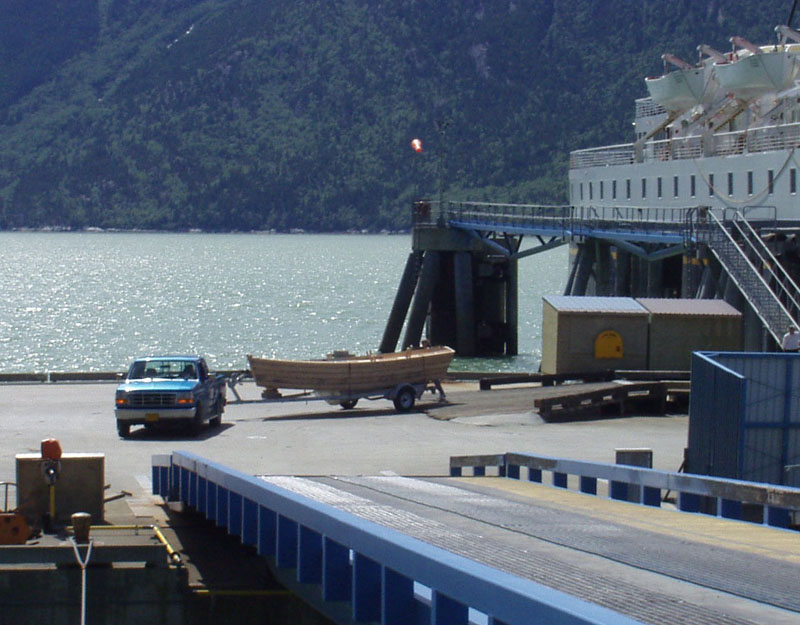
The width and height of the screenshot is (800, 625). Find the location of `stair railings`. stair railings is located at coordinates (661, 209), (754, 270), (782, 309), (785, 272), (757, 238).